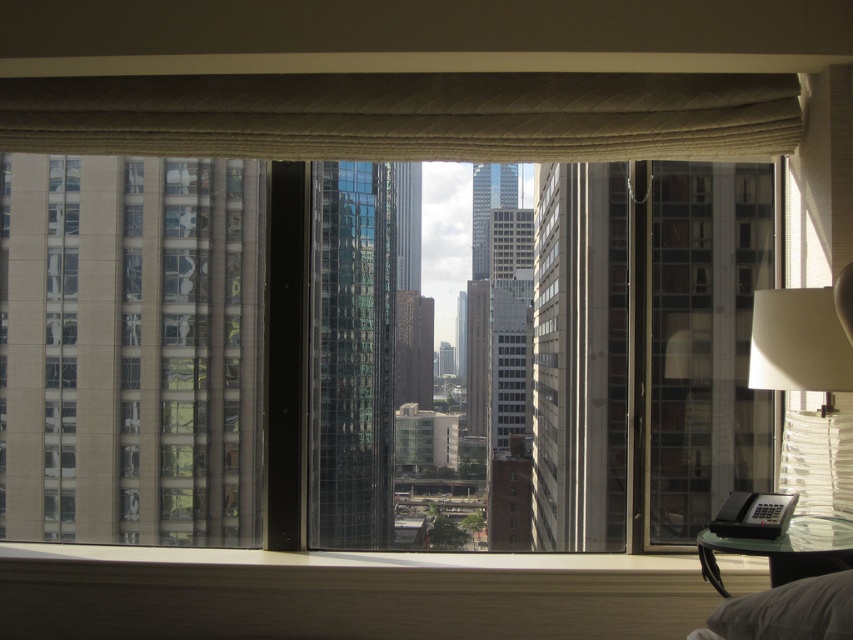
Question: Which object appears closest to the camera in this image?

Choices:
 (A) beige textured curtain at upper center
 (B) transparent glass window at center

Answer: (A)

Question: Does transparent glass window at center have a smaller size compared to beige textured curtain at upper center?

Choices:
 (A) yes
 (B) no

Answer: (B)

Question: Is transparent glass window at center above beige textured curtain at upper center?

Choices:
 (A) no
 (B) yes

Answer: (A)

Question: Which of the following is the farthest from the observer?

Choices:
 (A) transparent glass window at center
 (B) beige textured curtain at upper center
 (C) white textured lampshade at right

Answer: (A)

Question: From the image, what is the correct spatial relationship of beige textured curtain at upper center in relation to white textured lampshade at right?

Choices:
 (A) right
 (B) left

Answer: (B)

Question: Which point is closer to the camera taking this photo?

Choices:
 (A) (538, 336)
 (B) (625, 134)
 (C) (834, 344)

Answer: (C)